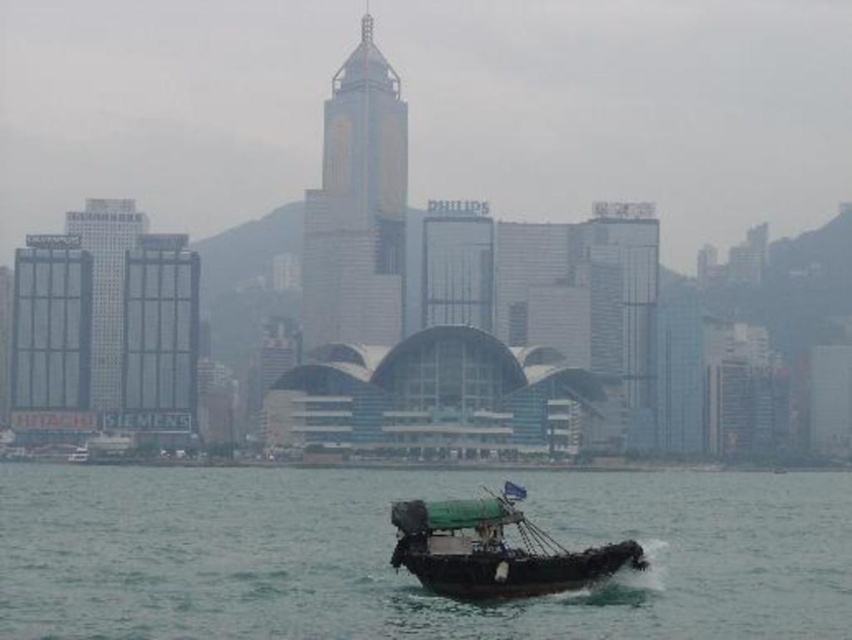
Question: Which of the following is the closest to the observer?

Choices:
 (A) (396, 512)
 (B) (35, 520)

Answer: (A)

Question: Can you confirm if green rubber boat at lower center is positioned above green canvas boat at lower center?

Choices:
 (A) yes
 (B) no

Answer: (B)

Question: Can you confirm if green rubber boat at lower center is positioned above green canvas boat at lower center?

Choices:
 (A) yes
 (B) no

Answer: (B)

Question: Can you confirm if green rubber boat at lower center is positioned to the right of green canvas boat at lower center?

Choices:
 (A) yes
 (B) no

Answer: (B)

Question: Which point is closer to the camera?

Choices:
 (A) green canvas boat at lower center
 (B) green rubber boat at lower center

Answer: (A)